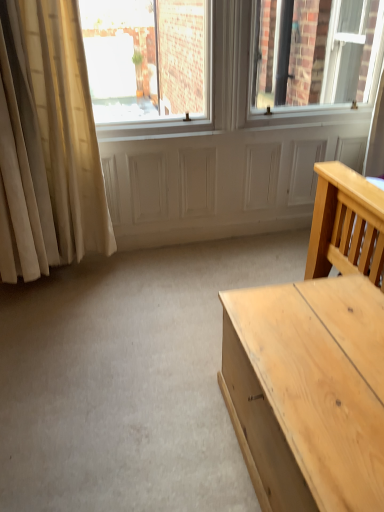
Identify the location of vacant space situated above light wood table at lower right (from a real-world perspective). This screenshot has height=512, width=384. (329, 356).